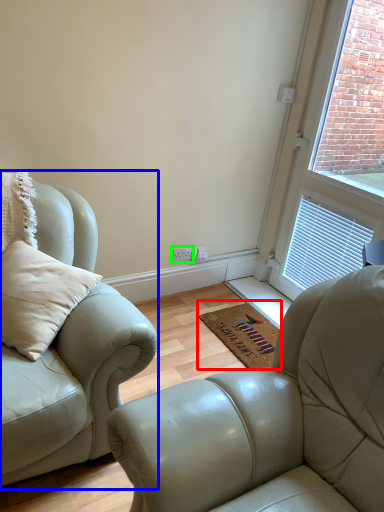
Question: Which object is the closest to the doormat (highlighted by a red box)? Choose among these: studio couch (highlighted by a blue box) or electric outlet (highlighted by a green box).

Choices:
 (A) studio couch
 (B) electric outlet

Answer: (B)